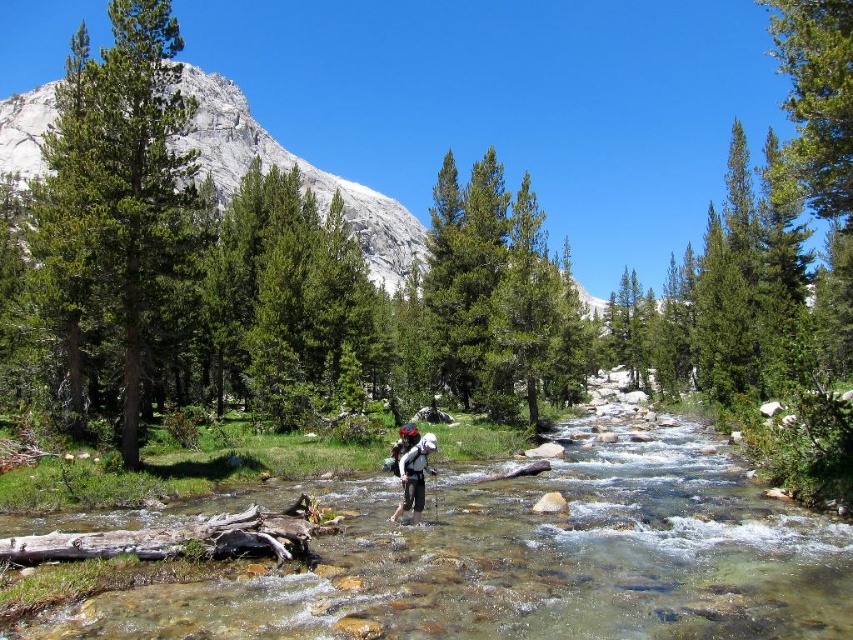
Question: Is green matte tree at left bigger than green matte tree at center?

Choices:
 (A) yes
 (B) no

Answer: (A)

Question: Can you confirm if clear glass stream at center is positioned below green matte tree at center?

Choices:
 (A) no
 (B) yes

Answer: (B)

Question: Which point is closer to the camera?

Choices:
 (A) white fabric backpack at center
 (B) green matte tree at center
 (C) clear glass stream at center

Answer: (C)

Question: Estimate the real-world distances between objects in this image. Which object is closer to the clear glass stream at center?

Choices:
 (A) green matte tree at center
 (B) green matte tree at left
 (C) white fabric backpack at center
 (D) gray rock mountain at upper left

Answer: (C)

Question: Among these points, which one is farthest from the camera?

Choices:
 (A) (476, 198)
 (B) (421, 486)
 (C) (753, 502)

Answer: (A)

Question: Does green matte tree at left appear on the left side of white fabric backpack at center?

Choices:
 (A) yes
 (B) no

Answer: (A)